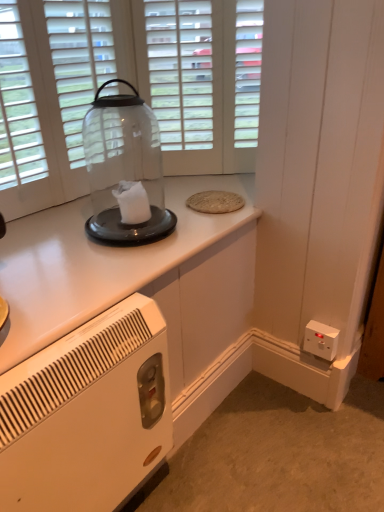
You are a GUI agent. You are given a task and a screenshot of the screen. Output one action in this format:
    pyautogui.click(x=<x>, y=<y>)
    Task: Click on the free space above white plastic heater at lower left (from a real-world perspective)
    
    Given the screenshot: What is the action you would take?
    pyautogui.click(x=71, y=338)